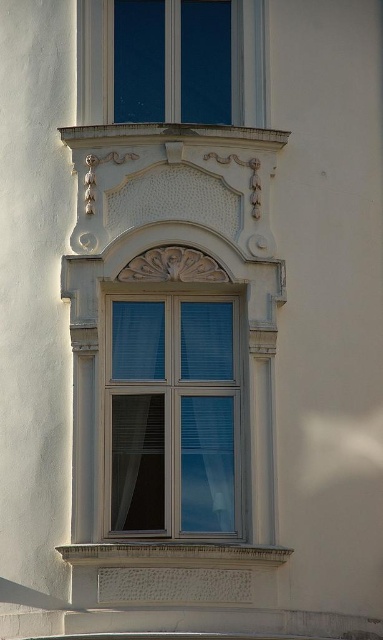
Is matte glass window at center bigger than white textured stone at lower center?

Incorrect, matte glass window at center is not larger than white textured stone at lower center.

Does matte glass window at center appear under white textured stone at lower center?

No, matte glass window at center is not below white textured stone at lower center.

The width and height of the screenshot is (383, 640). What do you see at coordinates (171, 416) in the screenshot? I see `matte glass window at center` at bounding box center [171, 416].

Locate an element on the screen. The width and height of the screenshot is (383, 640). matte glass window at center is located at coordinates (171, 416).

Does matte glass window at center appear on the left side of matte glass window at upper center?

No, matte glass window at center is not to the left of matte glass window at upper center.

Find the location of a particular element. The width and height of the screenshot is (383, 640). matte glass window at center is located at coordinates (171, 416).

Who is positioned more to the left, matte glass window at upper center or white textured stone at lower center?

matte glass window at upper center is more to the left.

How far apart are matte glass window at upper center and white textured stone at lower center?

matte glass window at upper center and white textured stone at lower center are 51.24 feet apart.

Between point (86, 124) and point (80, 552), which one is positioned behind?

Positioned behind is point (86, 124).

The width and height of the screenshot is (383, 640). In order to click on matte glass window at upper center in this screenshot , I will do `click(171, 61)`.